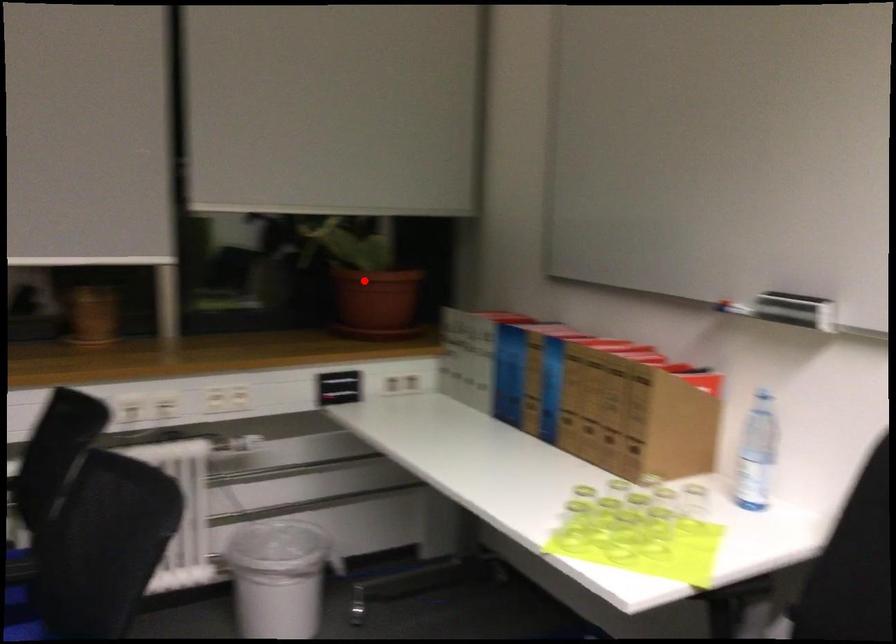
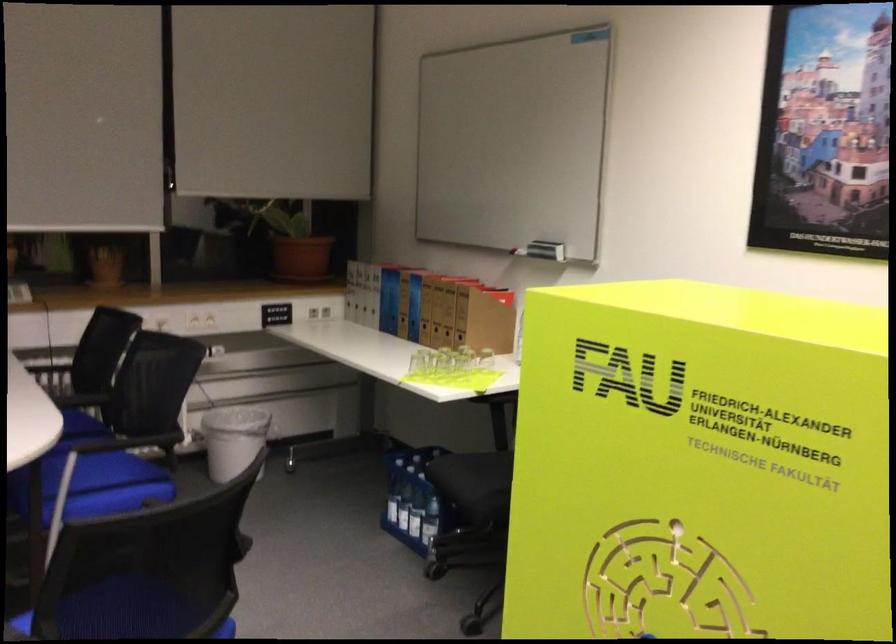
Question: I am providing you with two images of the same scene from different viewpoints. Image1 has a red point marked. In image2, the corresponding 3D location appears at what relative position? Reply with the corresponding letter.

Choices:
 (A) Closer
 (B) Farther

Answer: (B)